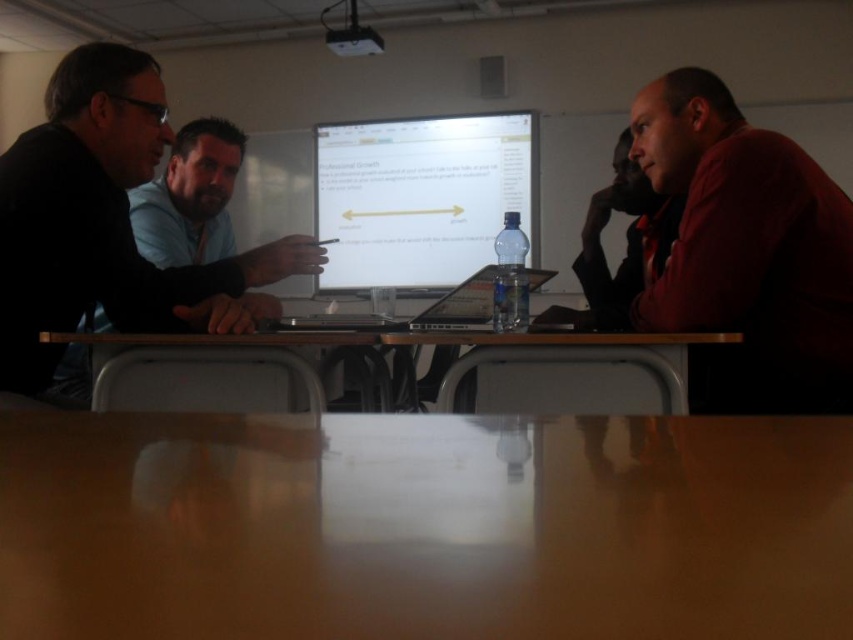
Question: Does glossy plastic table at center have a larger size compared to black plastic laptop at center?

Choices:
 (A) no
 (B) yes

Answer: (A)

Question: Among these points, which one is farthest from the camera?

Choices:
 (A) (405, 152)
 (B) (305, 557)

Answer: (A)

Question: Observing the image, what is the correct spatial positioning of glossy plastic table at center in reference to matte black laptop at left?

Choices:
 (A) above
 (B) below

Answer: (B)

Question: Is matte black laptop at left thinner than white glossy computer monitor at center?

Choices:
 (A) yes
 (B) no

Answer: (A)

Question: Among these objects, which one is nearest to the camera?

Choices:
 (A) smooth wooden table at center
 (B) glossy plastic table at center
 (C) matte black laptop at left
 (D) black plastic laptop at center

Answer: (B)

Question: Which of the following is the closest to the observer?

Choices:
 (A) (486, 307)
 (B) (9, 532)
 (C) (381, 122)

Answer: (B)